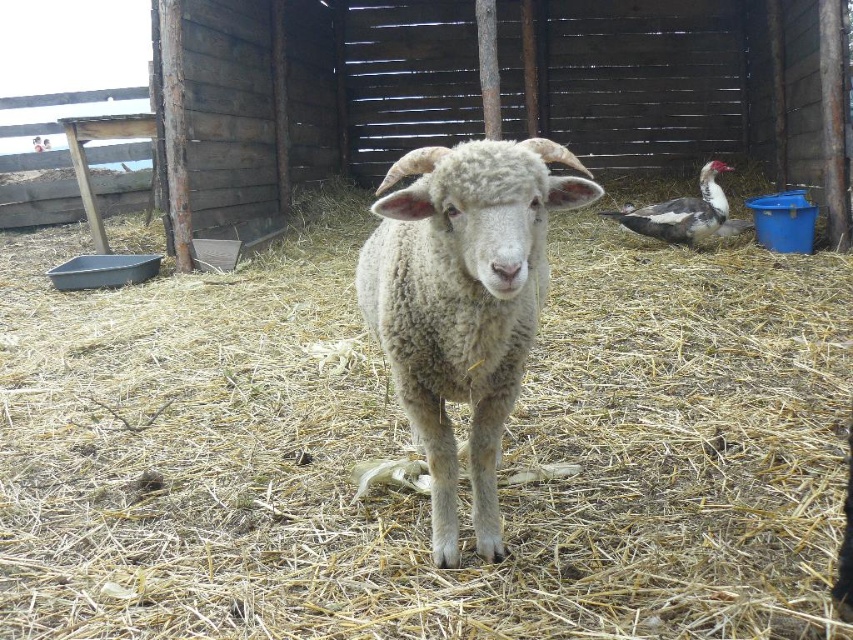
You are a farmer who needs to clean the enclosure. You have a pitchfork and want to move the fibrous straw at center to the corner. The lamb is currently near the center. Can you safely move the straw without disturbing the white woolly lamb at center?

The fibrous straw at center and white woolly lamb at center are 3.40 feet apart from each other. Since the distance is sufficient, you can safely move the fibrous straw at center without disturbing the lamb.